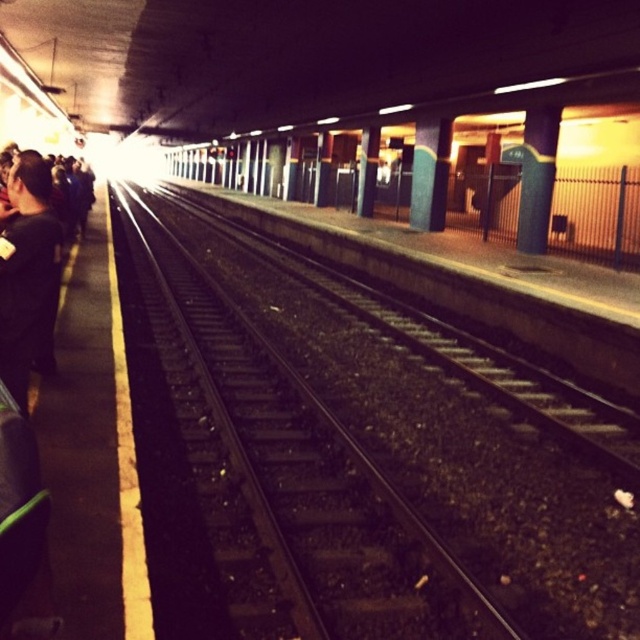
You are a commuter waiting on the subway platform and notice the black metal track at center and the black matte jacket at left. Which object is located to the right of the other?

The black metal track at center is positioned on the right side of black matte jacket at left, so the black metal track at center is to the right of the black matte jacket at left.

You are standing on the subway station platform at night. You notice a black matte jacket at left. Where exactly is the black matte jacket located on the platform?

The black matte jacket at left is located at point coordinates of 0.420 along the horizontal axis and 0.039 along the vertical axis.

You are a maintenance worker needing to reach the black metal track at center from the smooth concrete pillar at right. Can you safely walk directly to the track without crossing the yellow safety line?

The distance between the black metal track at center and the smooth concrete pillar at right is 6.11 meters. Since the yellow safety line is typically placed about 1 meter from the edge of the platform, you can safely walk to the track while staying behind the safety line.